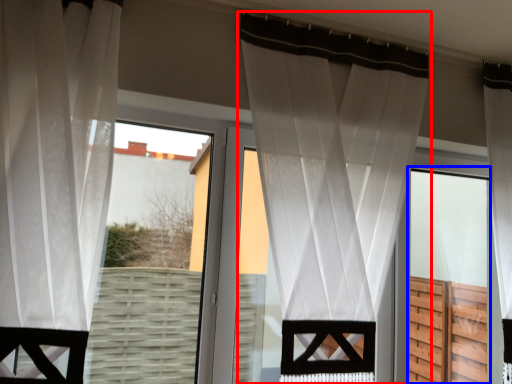
Question: Which object is further to the camera taking this photo, curtain (highlighted by a red box) or screen door (highlighted by a blue box)?

Choices:
 (A) curtain
 (B) screen door

Answer: (B)